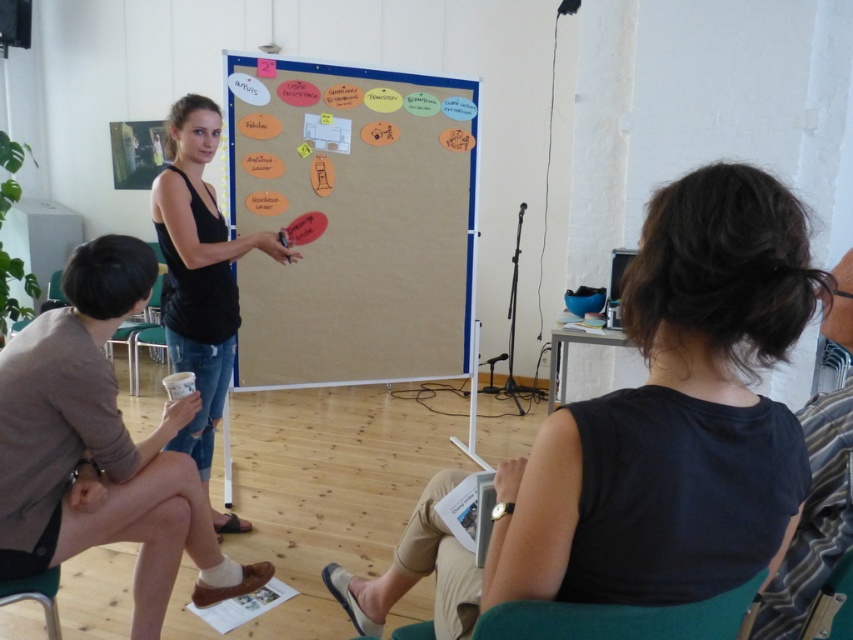
Question: Is black fabric shirt at center to the left of striped fabric shirt at right from the viewer's perspective?

Choices:
 (A) yes
 (B) no

Answer: (A)

Question: Which point is farther to the camera?

Choices:
 (A) corkboard at center
 (B) black matte tank top at center

Answer: (A)

Question: Does brown leather shoes at lower left appear on the left side of striped fabric shirt at right?

Choices:
 (A) yes
 (B) no

Answer: (A)

Question: Which point is closer to the camera?

Choices:
 (A) black fabric shirt at center
 (B) green fabric chair at lower center
 (C) corkboard at center

Answer: (B)

Question: Considering the real-world distances, which object is farthest from the striped fabric shirt at right?

Choices:
 (A) black fabric shirt at center
 (B) brown leather shoes at lower left
 (C) black matte tank top at center
 (D) green fabric chair at lower center

Answer: (C)

Question: Considering the relative positions of black fabric shirt at center and striped fabric shirt at right in the image provided, where is black fabric shirt at center located with respect to striped fabric shirt at right?

Choices:
 (A) right
 (B) left

Answer: (B)